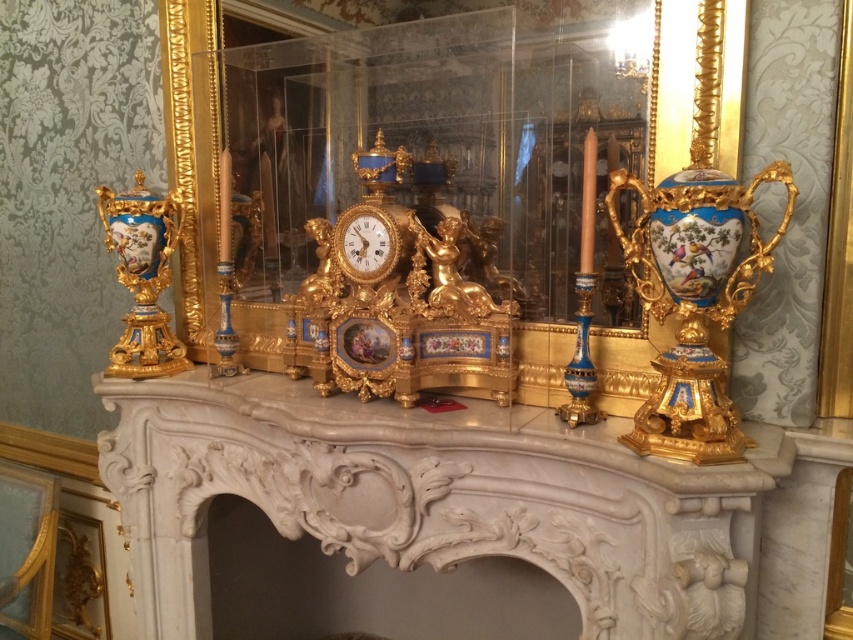
Can you confirm if white marble fireplace at center is positioned above porcelain blue vase at left?

No.

Does point (650, 621) come behind point (125, 193)?

No, (650, 621) is in front of (125, 193).

Which is in front, point (279, 458) or point (134, 362)?

Point (279, 458) is more forward.

At what (x,y) coordinates should I click in order to perform the action: click on white marble fireplace at center. Please return your answer as a coordinate pair (x, y). The height and width of the screenshot is (640, 853). Looking at the image, I should click on (433, 499).

Which is more to the right, white marble fireplace at center or gold/ornate clock at center?

From the viewer's perspective, white marble fireplace at center appears more on the right side.

Is white marble fireplace at center shorter than gold/ornate clock at center?

Incorrect, white marble fireplace at center's height does not fall short of gold/ornate clock at center's.

I want to click on white marble fireplace at center, so click(433, 499).

Find the location of a particular element. porcelain blue vase at right is located at coordinates (693, 298).

Can you confirm if porcelain blue vase at right is positioned to the left of porcelain blue vase at left?

In fact, porcelain blue vase at right is to the right of porcelain blue vase at left.

Image resolution: width=853 pixels, height=640 pixels. Find the location of `porcelain blue vase at right`. porcelain blue vase at right is located at coordinates (693, 298).